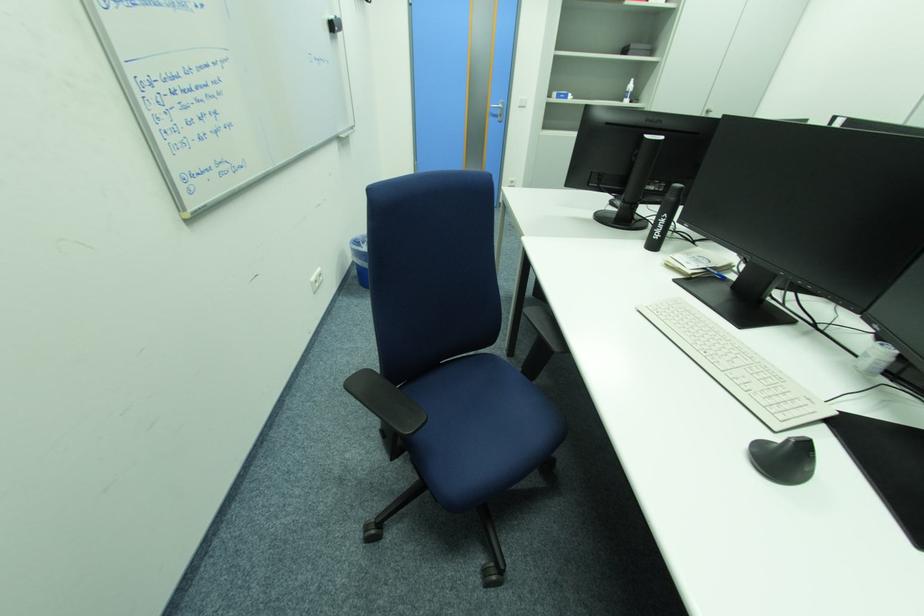
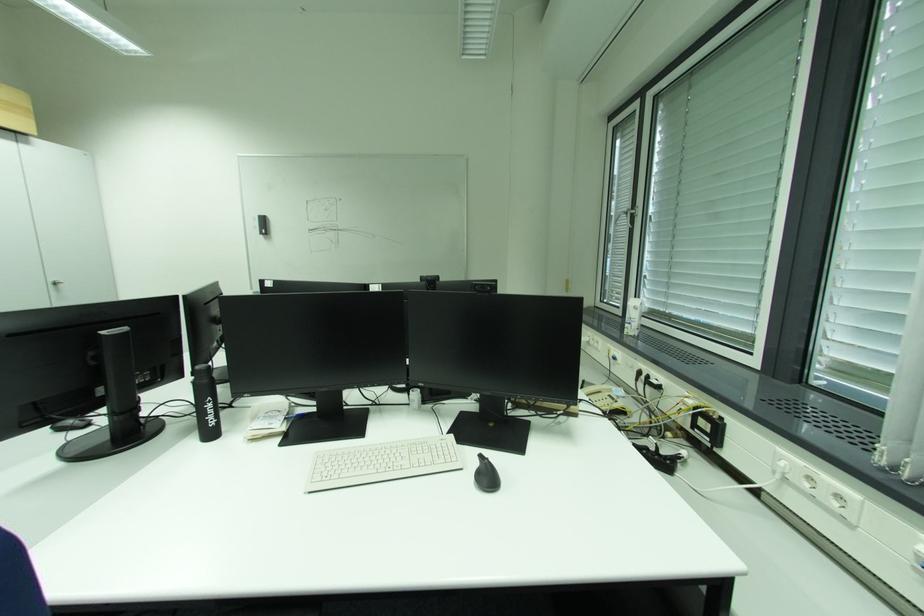
Question: The first image is from the beginning of the video and the second image is from the end. How did the camera likely rotate when shooting the video?

Choices:
 (A) Left
 (B) Right
 (C) Up
 (D) Down

Answer: (B)